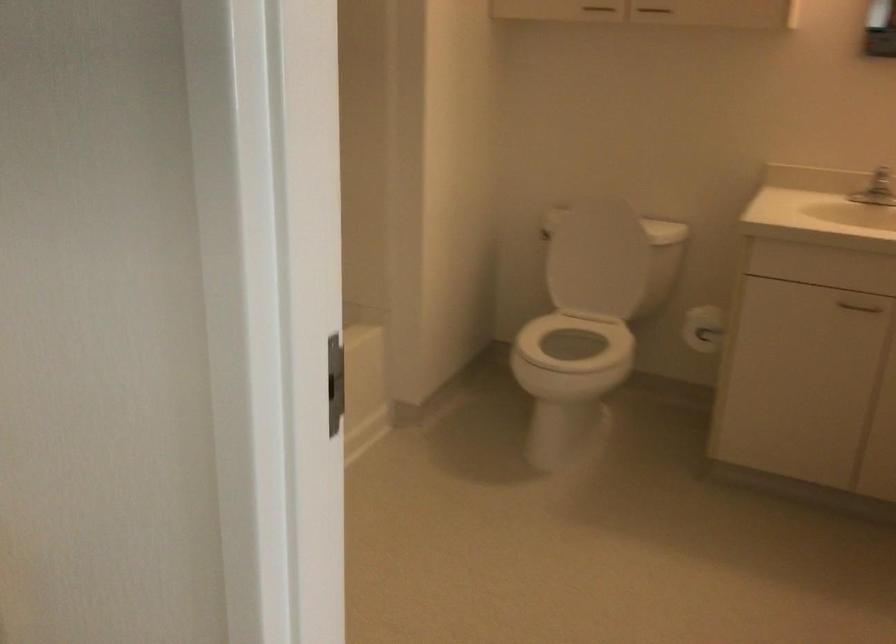
Find the location of a particular element. This screenshot has width=896, height=644. white toilet lid is located at coordinates (596, 258).